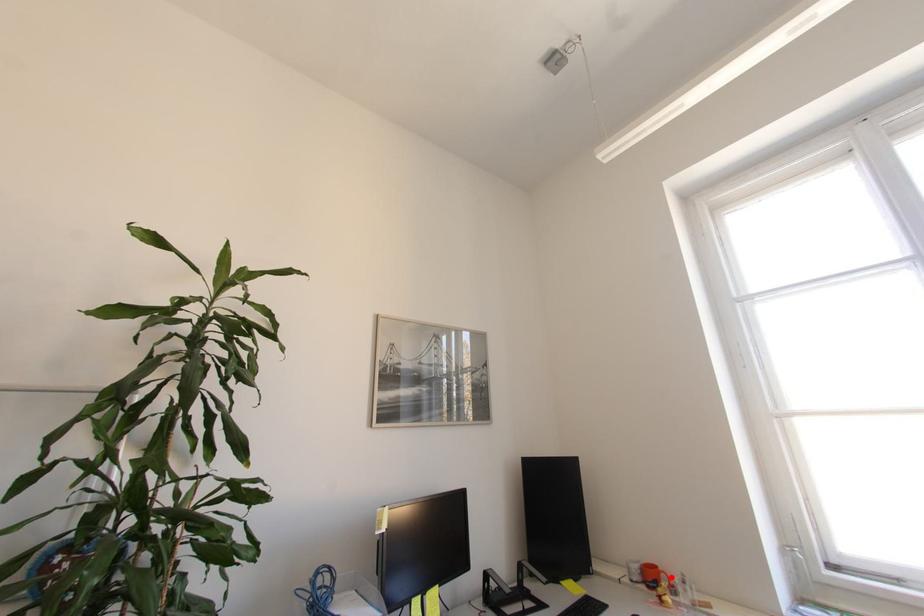
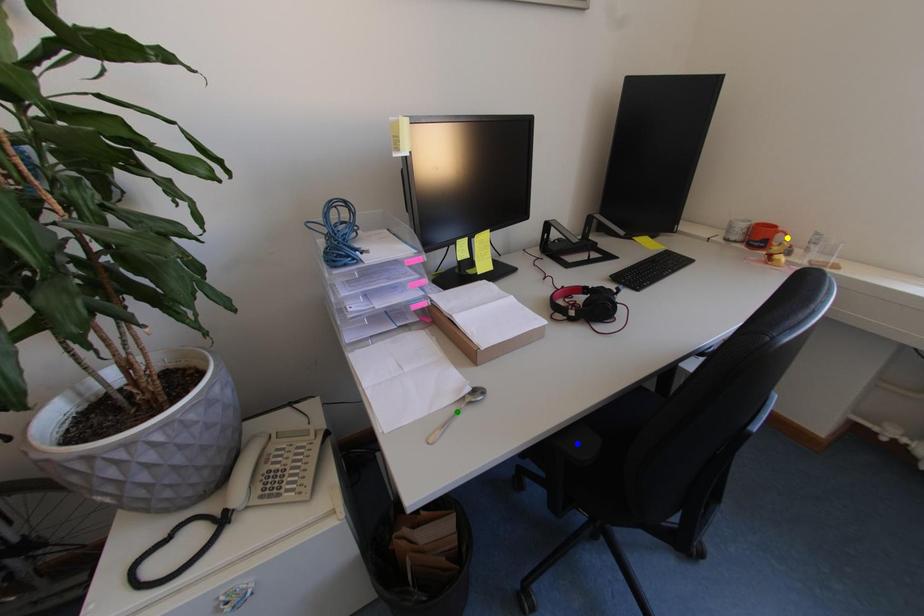
Question: I am providing you with two images of the same scene from different viewpoints. A red point is marked on the first image. You are given multiple points on the second image. In image 2, which mark is for the same physical point as the one in image 1?

Choices:
 (A) green point
 (B) blue point
 (C) yellow point

Answer: (C)